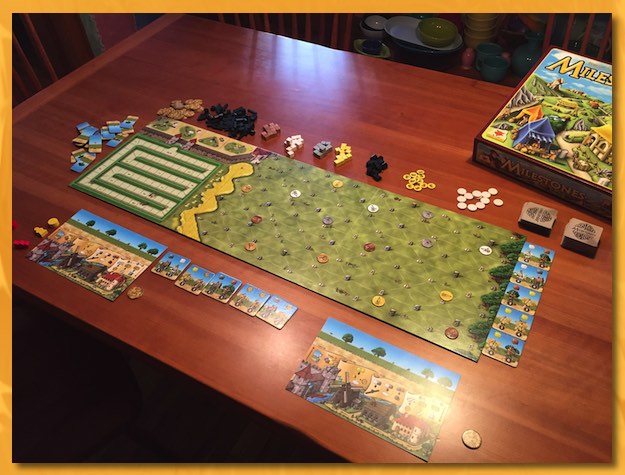
What are the coordinates of `empty space top left of table` in the screenshot? It's located at (262, 54).